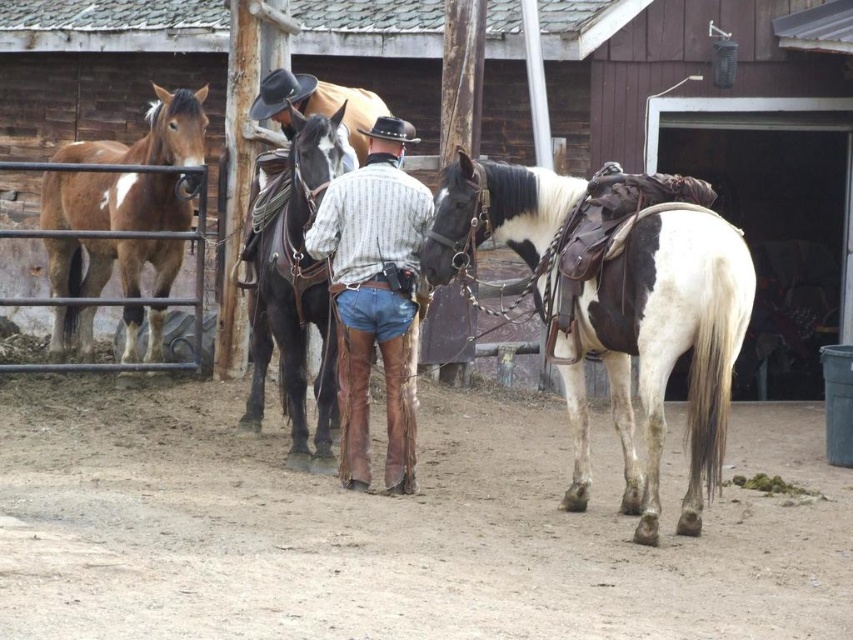
Question: Is white and black speckled saddle at right in front of brown glossy horse at left?

Choices:
 (A) yes
 (B) no

Answer: (A)

Question: Can you confirm if white and black speckled saddle at right is positioned to the right of brown glossy horse at left?

Choices:
 (A) yes
 (B) no

Answer: (A)

Question: Which point is closer to the camera?

Choices:
 (A) white and black speckled saddle at right
 (B) black leather horse at center

Answer: (A)

Question: Which of these objects is positioned closest to the brown leather boots at center?

Choices:
 (A) white and black speckled saddle at right
 (B) leather cowboy hat at center
 (C) brown glossy horse at left
 (D) black leather horse at center

Answer: (D)

Question: Based on their relative distances, which object is nearer to the leather cowboy hat at center?

Choices:
 (A) black leather horse at center
 (B) brown leather boots at center
 (C) brown glossy horse at left
 (D) white and black speckled saddle at right

Answer: (A)

Question: Does white and black speckled saddle at right appear on the right side of brown glossy horse at left?

Choices:
 (A) yes
 (B) no

Answer: (A)